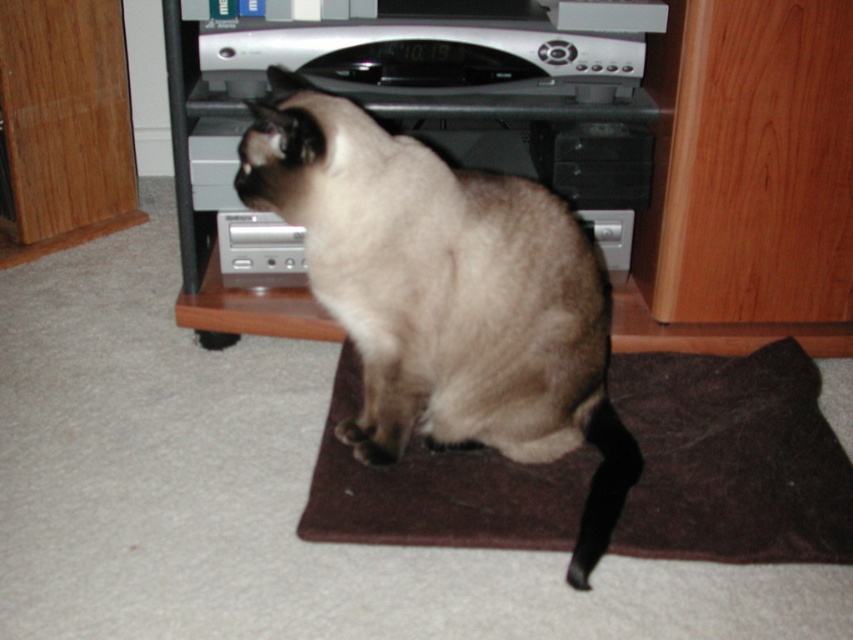
Who is more forward, (451, 481) or (753, 22)?

Positioned in front is point (451, 481).

Does brown felt mat at center appear on the left side of silver metallic entertainment center at center?

Yes, brown felt mat at center is to the left of silver metallic entertainment center at center.

Who is more forward, (654, 460) or (190, 320)?

Point (654, 460) is more forward.

You are a GUI agent. You are given a task and a screenshot of the screen. Output one action in this format:
    pyautogui.click(x=<x>, y=<y>)
    Task: Click on the brown felt mat at center
    
    Given the screenshot: What is the action you would take?
    pyautogui.click(x=730, y=460)

Can you confirm if smokey fur cat at center is smaller than silver metallic entertainment center at center?

Incorrect, smokey fur cat at center is not smaller in size than silver metallic entertainment center at center.

Is smokey fur cat at center further to camera compared to silver metallic entertainment center at center?

No.

Is point (431, 269) behind point (268, 292)?

No, it is in front of (268, 292).

In order to click on smokey fur cat at center in this screenshot , I will do `click(445, 294)`.

Can you confirm if smokey fur cat at center is bigger than brown felt mat at center?

Correct, smokey fur cat at center is larger in size than brown felt mat at center.

Is point (489, 444) positioned behind point (787, 493)?

Yes, point (489, 444) is behind point (787, 493).

The image size is (853, 640). Identify the location of smokey fur cat at center. pyautogui.click(x=445, y=294).